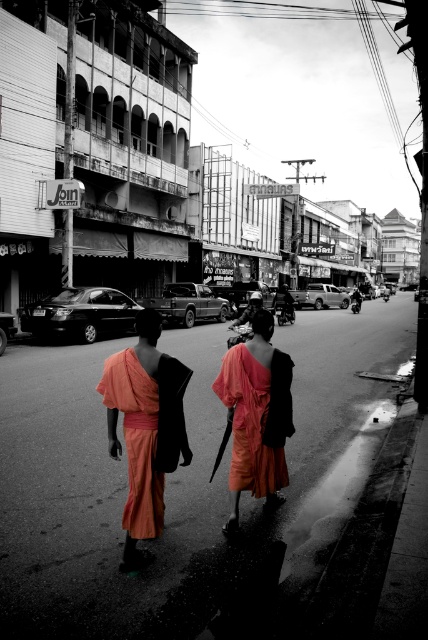
Question: Which point appears closest to the camera in this image?

Choices:
 (A) (287, 433)
 (B) (143, 465)

Answer: (B)

Question: Can you confirm if orange cotton robe at center is positioned to the right of matte orange robe at center?

Choices:
 (A) no
 (B) yes

Answer: (A)

Question: Is orange cotton robe at center below matte orange robe at center?

Choices:
 (A) yes
 (B) no

Answer: (B)

Question: Can you confirm if orange cotton robe at center is smaller than matte orange robe at center?

Choices:
 (A) no
 (B) yes

Answer: (B)

Question: Among these objects, which one is farthest from the camera?

Choices:
 (A) matte orange robe at center
 (B) orange cotton robe at center

Answer: (A)